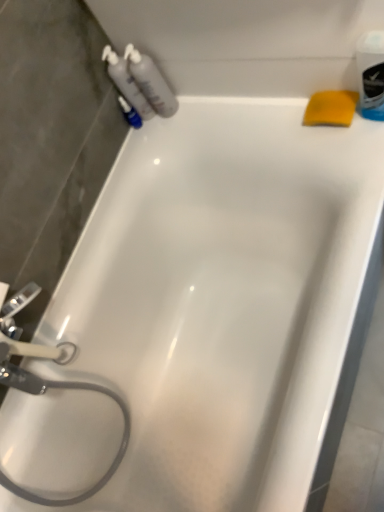
Describe the element at coordinates (331, 108) in the screenshot. The image size is (384, 512). I see `yellow sponge at upper right` at that location.

The height and width of the screenshot is (512, 384). What do you see at coordinates (126, 82) in the screenshot? I see `translucent plastic bottles at upper left, which is the 2th cleaning product in right-to-left order` at bounding box center [126, 82].

The height and width of the screenshot is (512, 384). Identify the location of yellow sponge at upper right. pyautogui.click(x=331, y=108).

Between translucent plastic bottles at upper left, positioned as the first cleaning product in right-to-left order, and blue plastic mouthwash at upper right, which one appears on the right side from the viewer's perspective?

blue plastic mouthwash at upper right is more to the right.

Is translucent plastic bottles at upper left, acting as the second cleaning product starting from the left, not close to blue plastic mouthwash at upper right?

That's not correct — translucent plastic bottles at upper left, acting as the second cleaning product starting from the left, is a little close to blue plastic mouthwash at upper right.

Locate an element on the screen. The width and height of the screenshot is (384, 512). cleaning product that is the 1st one when counting leftward from the blue plastic mouthwash at upper right is located at coordinates (151, 82).

Considering their positions, is translucent plastic bottles at upper left, acting as the second cleaning product starting from the left, located in front of or behind blue plastic mouthwash at upper right?

translucent plastic bottles at upper left, acting as the second cleaning product starting from the left, is behind blue plastic mouthwash at upper right.

Is blue plastic mouthwash at upper right not near translucent plastic bottles at upper left, acting as the second cleaning product starting from the left?

No, blue plastic mouthwash at upper right is in close proximity to translucent plastic bottles at upper left, acting as the second cleaning product starting from the left.

Can you confirm if blue plastic mouthwash at upper right is positioned to the left of translucent plastic bottles at upper left, positioned as the first cleaning product in right-to-left order?

No, blue plastic mouthwash at upper right is not to the left of translucent plastic bottles at upper left, positioned as the first cleaning product in right-to-left order.

Is blue plastic mouthwash at upper right completely or partially outside of translucent plastic bottles at upper left, positioned as the first cleaning product in right-to-left order?

Indeed, blue plastic mouthwash at upper right is completely outside translucent plastic bottles at upper left, positioned as the first cleaning product in right-to-left order.

Could you tell me if blue plastic mouthwash at upper right is facing translucent plastic bottles at upper left, positioned as the first cleaning product in right-to-left order?

No, blue plastic mouthwash at upper right is not oriented towards translucent plastic bottles at upper left, positioned as the first cleaning product in right-to-left order.

From the image's perspective, is translucent plastic bottles at upper left, which is counted as the 1th cleaning product, starting from the left, beneath blue plastic mouthwash at upper right?

No, from the image's perspective, translucent plastic bottles at upper left, which is counted as the 1th cleaning product, starting from the left, is not below blue plastic mouthwash at upper right.

Who is more distant, translucent plastic bottles at upper left, which is counted as the 1th cleaning product, starting from the left, or blue plastic mouthwash at upper right?

translucent plastic bottles at upper left, which is counted as the 1th cleaning product, starting from the left, is further away from the camera.

Between point (120, 72) and point (376, 63), which one is positioned in front?

The point (376, 63) is in front.

Is point (154, 109) positioned behind point (312, 120)?

That is True.

Which object is closer to the camera taking this photo, translucent plastic bottles at upper left, positioned as the first cleaning product in right-to-left order, or yellow sponge at upper right?

yellow sponge at upper right is more forward.

Is translucent plastic bottles at upper left, acting as the second cleaning product starting from the left, not close to yellow sponge at upper right?

That's not correct — translucent plastic bottles at upper left, acting as the second cleaning product starting from the left, is a little close to yellow sponge at upper right.

Are translucent plastic bottles at upper left, which is the 2th cleaning product in right-to-left order, and yellow sponge at upper right beside each other?

No, translucent plastic bottles at upper left, which is the 2th cleaning product in right-to-left order, is not touching yellow sponge at upper right.

Can you confirm if translucent plastic bottles at upper left, which is counted as the 1th cleaning product, starting from the left, is bigger than yellow sponge at upper right?

Yes, translucent plastic bottles at upper left, which is counted as the 1th cleaning product, starting from the left, is bigger than yellow sponge at upper right.

Which is more to the right, translucent plastic bottles at upper left, which is the 2th cleaning product in right-to-left order, or yellow sponge at upper right?

yellow sponge at upper right is more to the right.

Is point (127, 66) closer or farther from the camera than point (310, 101)?

Point (127, 66).

From a real-world perspective, is blue plastic mouthwash at upper right positioned over translucent plastic bottles at upper left, which is the 2th cleaning product in right-to-left order, based on gravity?

Incorrect, from a real-world perspective, blue plastic mouthwash at upper right is lower than translucent plastic bottles at upper left, which is the 2th cleaning product in right-to-left order.

Could you tell me if blue plastic mouthwash at upper right is facing translucent plastic bottles at upper left, which is the 2th cleaning product in right-to-left order?

No, blue plastic mouthwash at upper right is not facing towards translucent plastic bottles at upper left, which is the 2th cleaning product in right-to-left order.

Measure the distance between blue plastic mouthwash at upper right and translucent plastic bottles at upper left, which is the 2th cleaning product in right-to-left order.

The distance of blue plastic mouthwash at upper right from translucent plastic bottles at upper left, which is the 2th cleaning product in right-to-left order, is 56.91 centimeters.

Does blue plastic mouthwash at upper right have a lesser height compared to translucent plastic bottles at upper left, which is the 2th cleaning product in right-to-left order?

Yes, blue plastic mouthwash at upper right is shorter than translucent plastic bottles at upper left, which is the 2th cleaning product in right-to-left order.

Considering the relative sizes of yellow sponge at upper right and translucent plastic bottles at upper left, positioned as the first cleaning product in right-to-left order, in the image provided, is yellow sponge at upper right wider than translucent plastic bottles at upper left, positioned as the first cleaning product in right-to-left order,?

Correct, the width of yellow sponge at upper right exceeds that of translucent plastic bottles at upper left, positioned as the first cleaning product in right-to-left order.

Measure the distance from yellow sponge at upper right to translucent plastic bottles at upper left, positioned as the first cleaning product in right-to-left order.

yellow sponge at upper right is 16.25 inches away from translucent plastic bottles at upper left, positioned as the first cleaning product in right-to-left order.

From a real-world perspective, is yellow sponge at upper right located beneath translucent plastic bottles at upper left, positioned as the first cleaning product in right-to-left order?

Yes, from a real-world perspective, yellow sponge at upper right is under translucent plastic bottles at upper left, positioned as the first cleaning product in right-to-left order.

Is translucent plastic bottles at upper left, positioned as the first cleaning product in right-to-left order, a part of yellow sponge at upper right?

No.

Where is `mouthwash that is under the translucent plastic bottles at upper left, positioned as the first cleaning product in right-to-left order (from a real-world perspective)`? The image size is (384, 512). mouthwash that is under the translucent plastic bottles at upper left, positioned as the first cleaning product in right-to-left order (from a real-world perspective) is located at coordinates (371, 74).

There is a blue plastic mouthwash at upper right. Where is `the 1st cleaning product above it (from the image's perspective)`? The height and width of the screenshot is (512, 384). the 1st cleaning product above it (from the image's perspective) is located at coordinates tap(151, 82).

Based on their spatial positions, is blue plastic mouthwash at upper right or yellow sponge at upper right closer to translucent plastic bottles at upper left, positioned as the first cleaning product in right-to-left order?

yellow sponge at upper right is positioned closer to the anchor translucent plastic bottles at upper left, positioned as the first cleaning product in right-to-left order.

Considering their positions, is blue plastic mouthwash at upper right positioned closer to yellow sponge at upper right than translucent plastic bottles at upper left, positioned as the first cleaning product in right-to-left order?

blue plastic mouthwash at upper right.

When comparing their distances from translucent plastic bottles at upper left, acting as the second cleaning product starting from the left, does translucent plastic bottles at upper left, which is the 2th cleaning product in right-to-left order, or yellow sponge at upper right seem closer?

Among the two, translucent plastic bottles at upper left, which is the 2th cleaning product in right-to-left order, is located nearer to translucent plastic bottles at upper left, acting as the second cleaning product starting from the left.

Based on their spatial positions, is translucent plastic bottles at upper left, which is the 2th cleaning product in right-to-left order, or yellow sponge at upper right further from blue plastic mouthwash at upper right?

Among the two, translucent plastic bottles at upper left, which is the 2th cleaning product in right-to-left order, is located further to blue plastic mouthwash at upper right.

In the scene shown: Looking at the image, which one is located closer to blue plastic mouthwash at upper right, yellow sponge at upper right or translucent plastic bottles at upper left, positioned as the first cleaning product in right-to-left order?

yellow sponge at upper right lies closer to blue plastic mouthwash at upper right than the other object.

Based on their spatial positions, is blue plastic mouthwash at upper right or yellow sponge at upper right further from translucent plastic bottles at upper left, which is counted as the 1th cleaning product, starting from the left?

blue plastic mouthwash at upper right lies further to translucent plastic bottles at upper left, which is counted as the 1th cleaning product, starting from the left, than the other object.

Looking at the image, which one is located closer to blue plastic mouthwash at upper right, yellow sponge at upper right or translucent plastic bottles at upper left, which is counted as the 1th cleaning product, starting from the left?

yellow sponge at upper right lies closer to blue plastic mouthwash at upper right than the other object.

Considering their positions, is blue plastic mouthwash at upper right positioned closer to translucent plastic bottles at upper left, which is the 2th cleaning product in right-to-left order, than translucent plastic bottles at upper left, positioned as the first cleaning product in right-to-left order?

Among the two, translucent plastic bottles at upper left, positioned as the first cleaning product in right-to-left order, is located nearer to translucent plastic bottles at upper left, which is the 2th cleaning product in right-to-left order.

In order to click on cleaning product between translucent plastic bottles at upper left, which is the 2th cleaning product in right-to-left order, and blue plastic mouthwash at upper right, in the horizontal direction in this screenshot , I will do `click(151, 82)`.

Identify the location of soap between translucent plastic bottles at upper left, which is the 2th cleaning product in right-to-left order, and blue plastic mouthwash at upper right from left to right. The image size is (384, 512). (331, 108).

Where is `cleaning product between translucent plastic bottles at upper left, which is the 2th cleaning product in right-to-left order, and yellow sponge at upper right`? Image resolution: width=384 pixels, height=512 pixels. cleaning product between translucent plastic bottles at upper left, which is the 2th cleaning product in right-to-left order, and yellow sponge at upper right is located at coordinates (151, 82).

You are a GUI agent. You are given a task and a screenshot of the screen. Output one action in this format:
    pyautogui.click(x=<x>, y=<y>)
    Task: Click on the soap between translucent plastic bottles at upper left, positioned as the first cleaning product in right-to-left order, and blue plastic mouthwash at upper right
    
    Given the screenshot: What is the action you would take?
    pyautogui.click(x=331, y=108)